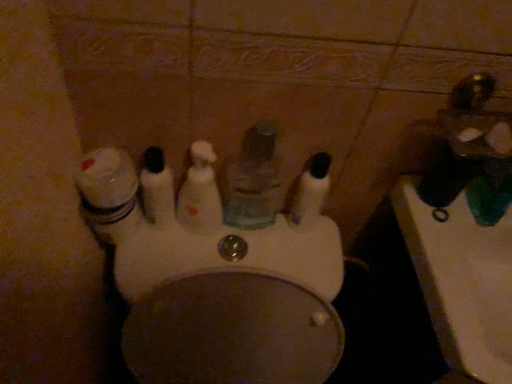
Question: Considering their positions, is white glossy jar at left located in front of or behind translucent plastic mouthwash at center, which is counted as the third mouthwash, starting from the left?

Choices:
 (A) front
 (B) behind

Answer: (A)

Question: From their relative heights in the image, would you say white glossy jar at left is taller or shorter than translucent plastic mouthwash at center, which is counted as the third mouthwash, starting from the left?

Choices:
 (A) tall
 (B) short

Answer: (B)

Question: Based on their relative distances, which object is farther from the white glossy toilet at center?

Choices:
 (A) white glossy jar at left
 (B) gold metallic faucet at upper right
 (C) translucent plastic mouthwash at center, which is counted as the third mouthwash, starting from the left
 (D) translucent plastic mouthwash at center, which is the second mouthwash in left-to-right order
 (E) translucent plastic mouthwash at center, acting as the fourth mouthwash starting from the left

Answer: (B)

Question: Which is farther from the gold metallic faucet at upper right?

Choices:
 (A) translucent plastic mouthwash at center, which appears as the 2th mouthwash when viewed from the right
 (B) white glossy toilet at center
 (C) translucent plastic mouthwash at center, acting as the fourth mouthwash starting from the left
 (D) translucent plastic mouthwash at center, marked as the 1th mouthwash in a left-to-right arrangement
 (E) translucent plastic mouthwash at center, which is the second mouthwash in left-to-right order

Answer: (D)